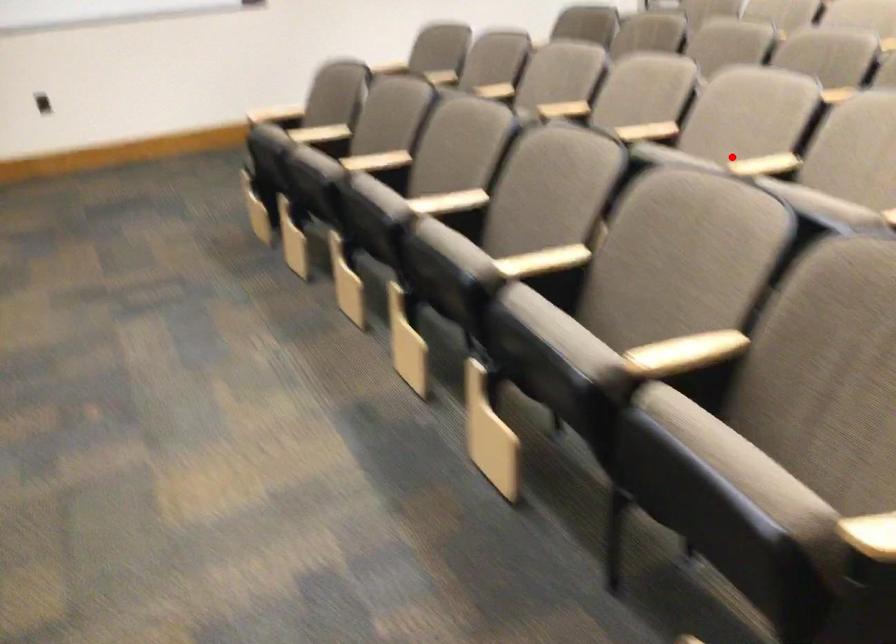
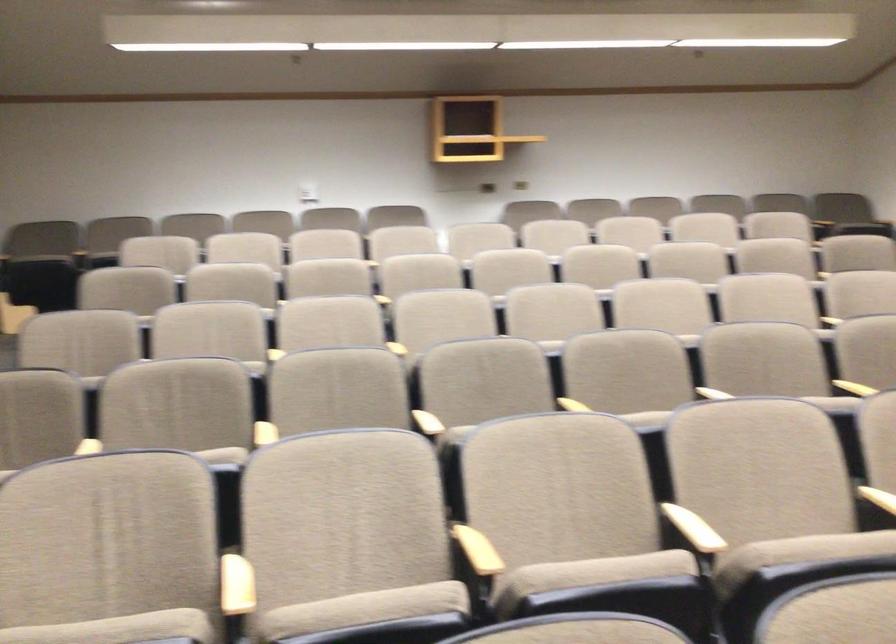
Locate, in the second image, the point that corresponds to the highlighted location in the first image.

(877, 498)